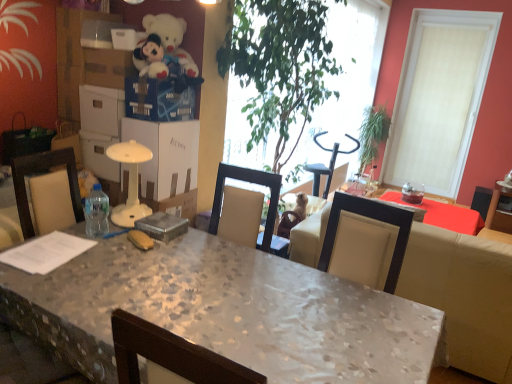
Question: Is white plush teddy bear at upper left located within green leafy plant at center, positioned as the 2th houseplant in back-to-front order?

Choices:
 (A) no
 (B) yes

Answer: (A)

Question: From the image's perspective, does green leafy plant at center, the first houseplant from the left, appear higher than white plush teddy bear at upper left?

Choices:
 (A) yes
 (B) no

Answer: (B)

Question: Is green leafy plant at center, the 2th houseplant when ordered from right to left, turned away from white plush teddy bear at upper left?

Choices:
 (A) no
 (B) yes

Answer: (A)

Question: Is the position of green leafy plant at center, positioned as the 2th houseplant in back-to-front order, more distant than that of white plush teddy bear at upper left?

Choices:
 (A) no
 (B) yes

Answer: (A)

Question: From a real-world perspective, is green leafy plant at center, the first houseplant from the left, positioned over white plush teddy bear at upper left based on gravity?

Choices:
 (A) no
 (B) yes

Answer: (A)

Question: Considering the positions of clear plastic bottle at table left and metallic gray box at center in the image, is clear plastic bottle at table left taller or shorter than metallic gray box at center?

Choices:
 (A) short
 (B) tall

Answer: (B)

Question: Is point (88, 200) closer or farther from the camera than point (169, 223)?

Choices:
 (A) closer
 (B) farther

Answer: (B)

Question: Is clear plastic bottle at table left inside the boundaries of metallic gray box at center, or outside?

Choices:
 (A) outside
 (B) inside

Answer: (A)

Question: From a real-world perspective, is clear plastic bottle at table left physically located above or below metallic gray box at center?

Choices:
 (A) above
 (B) below

Answer: (A)

Question: Is white textured window at upper right to the left or to the right of white cardboard box at center in the image?

Choices:
 (A) left
 (B) right

Answer: (B)

Question: In terms of size, does white textured window at upper right appear bigger or smaller than white cardboard box at center?

Choices:
 (A) small
 (B) big

Answer: (B)

Question: Is point (415, 129) positioned closer to the camera than point (177, 124)?

Choices:
 (A) farther
 (B) closer

Answer: (A)

Question: Considering their positions, is white textured window at upper right located in front of or behind white cardboard box at center?

Choices:
 (A) behind
 (B) front

Answer: (A)

Question: In terms of height, does white cardboard box at center look taller or shorter compared to metallic gray box at center?

Choices:
 (A) tall
 (B) short

Answer: (A)

Question: Visually, is white cardboard box at center positioned to the left or to the right of metallic gray box at center?

Choices:
 (A) left
 (B) right

Answer: (A)